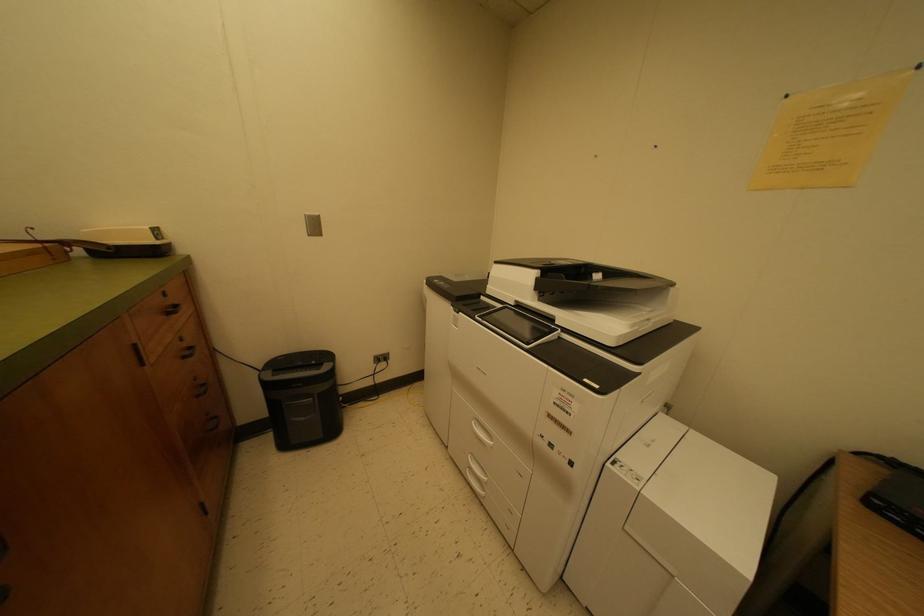
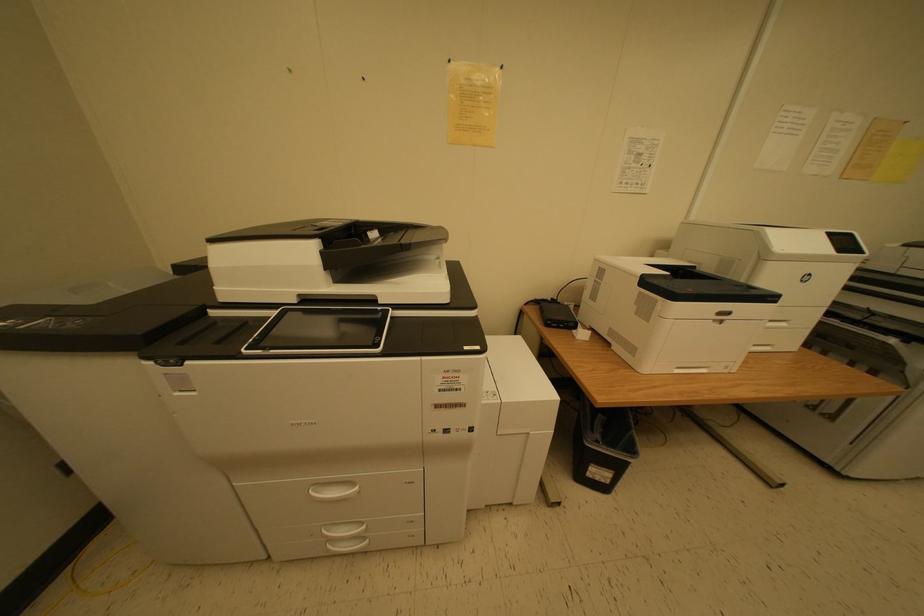
From the picture: How did the camera likely rotate?

The camera's rotation is toward right-down.